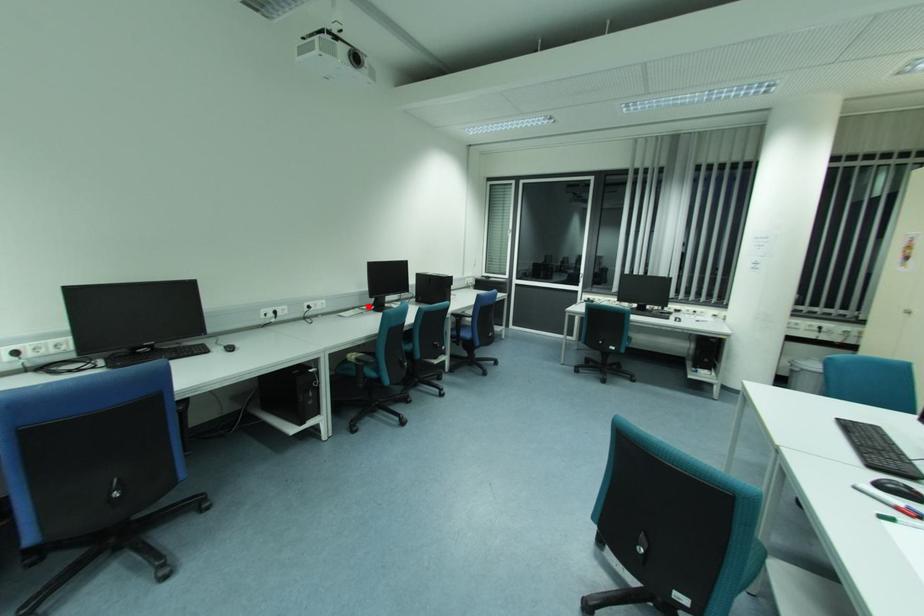
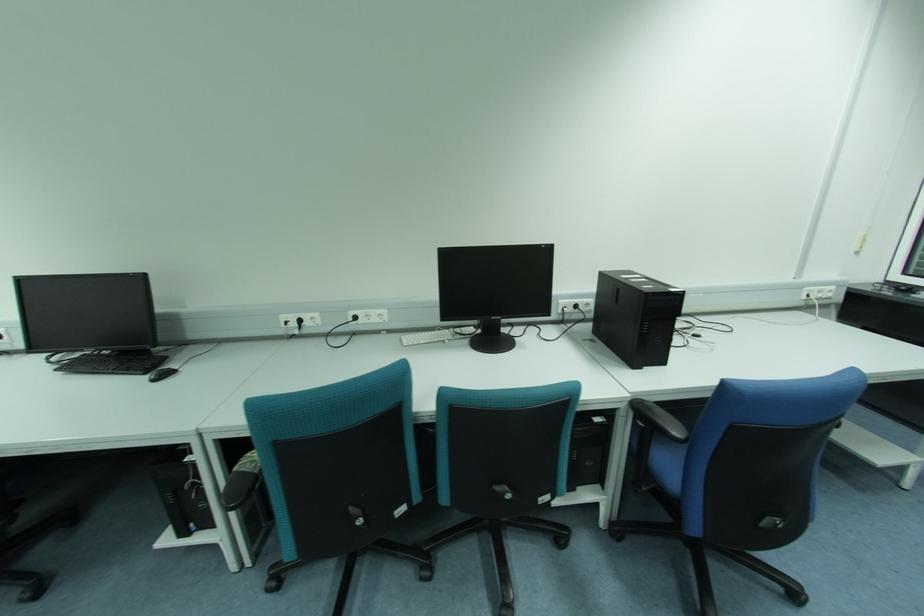
Where in the second image is the point corresponding to the highlighted location from the first image?

(476, 326)